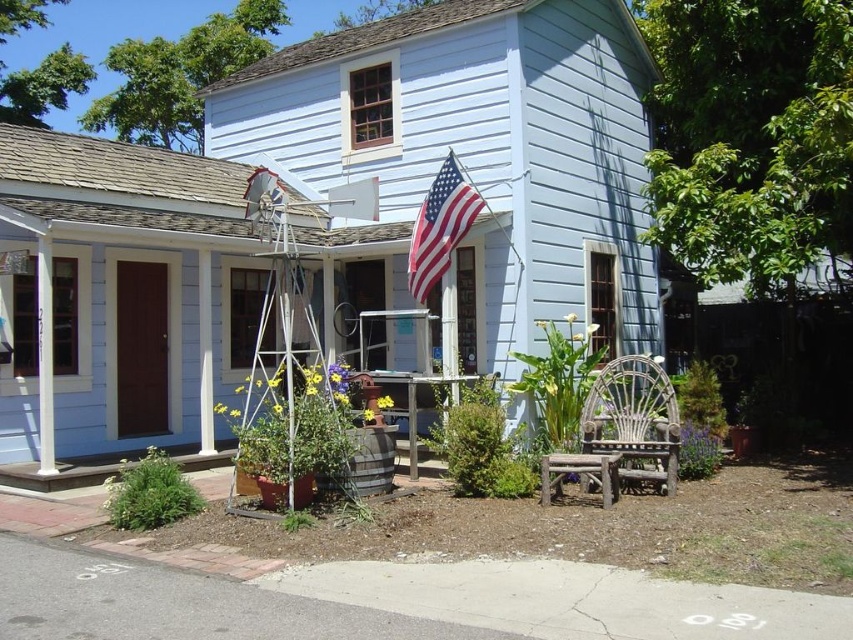
You are a visitor approaching the house and want to sit down on the rustic wood stool at lower center. Can you reach it without moving the white painted wood at center?

The rustic wood stool at lower center is behind the white painted wood at center, so you would need to move the white painted wood at center to access the stool.

You are a guest arriving at the house and want to sit down. You see a white wicker chair at lower right and a white painted wood at center. Which object is closer to the entrance of the house?

The white wicker chair at lower right is closer to the entrance of the house because it is in front of the white painted wood at center.

You are standing at the entrance of the house and want to place a new flower pot exactly halfway between the metallic silver windmill at center and the wooden door on the left. Can you determine the coordinates where you should place the flower pot?

The metallic silver windmill at center is located at point (x=276, y=362). To find the halfway point between it and the wooden door on the left, you would need the coordinates of the wooden door on the left. Since the coordinates of the wooden door on the left are not provided, I cannot calculate the exact midpoint.